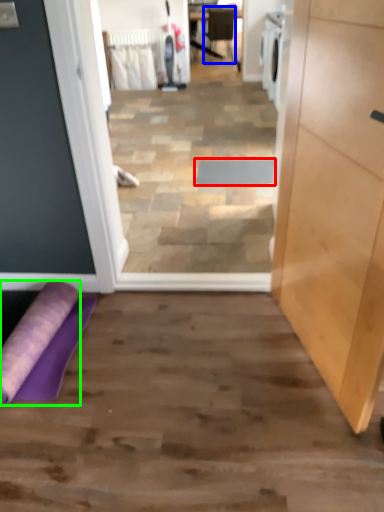
Question: Based on their relative distances, which object is farther from doormat (highlighted by a red box)? Choose from chair (highlighted by a blue box) and beach towel (highlighted by a green box).

Choices:
 (A) chair
 (B) beach towel

Answer: (A)